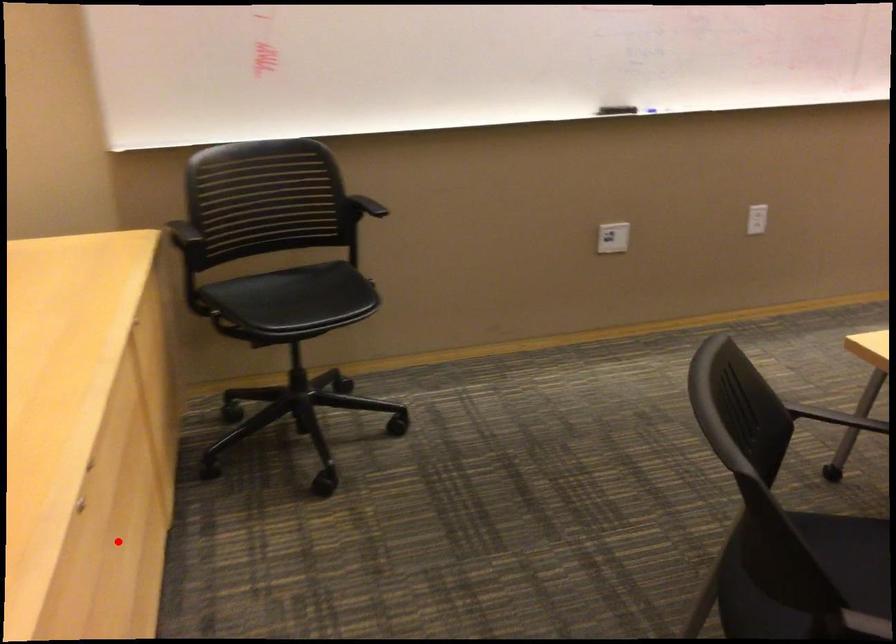
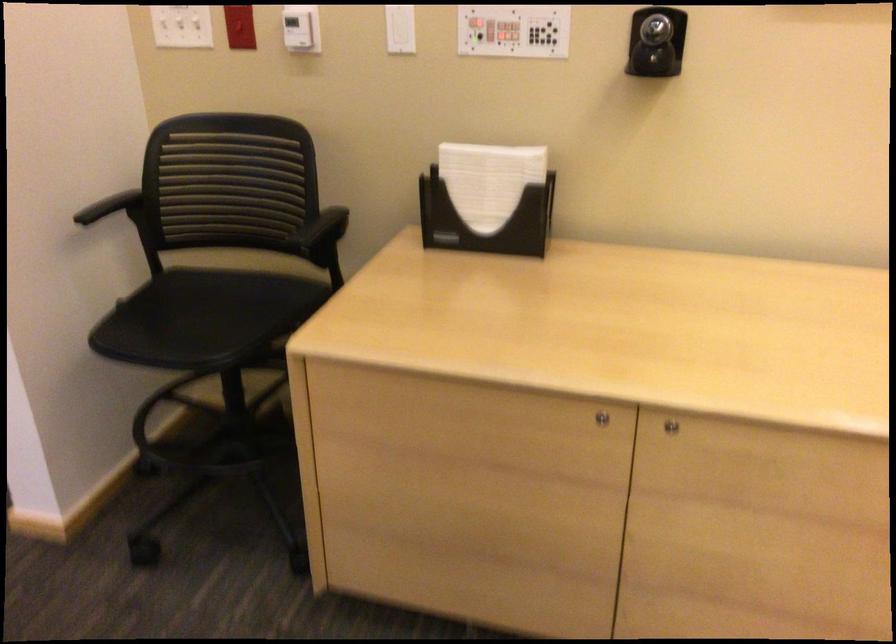
In the second image, find the point that corresponds to the highlighted location in the first image.

(670, 426)